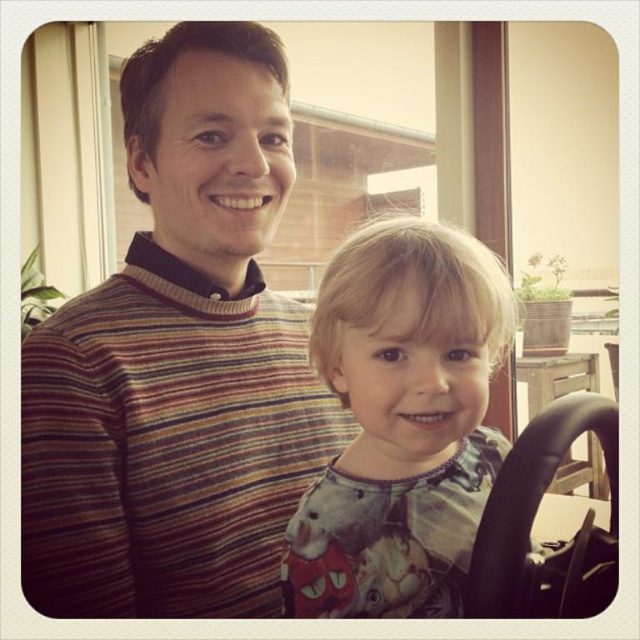
Which is behind, point (246, 348) or point (372, 461)?

Point (246, 348)

Is striped sweater at left above printed cotton shirt at center?

Result: Yes, striped sweater at left is above printed cotton shirt at center.

Is point (269, 602) more distant than point (324, 339)?

Yes, it is.

Where is `striped sweater at left`? This screenshot has width=640, height=640. striped sweater at left is located at coordinates (179, 360).